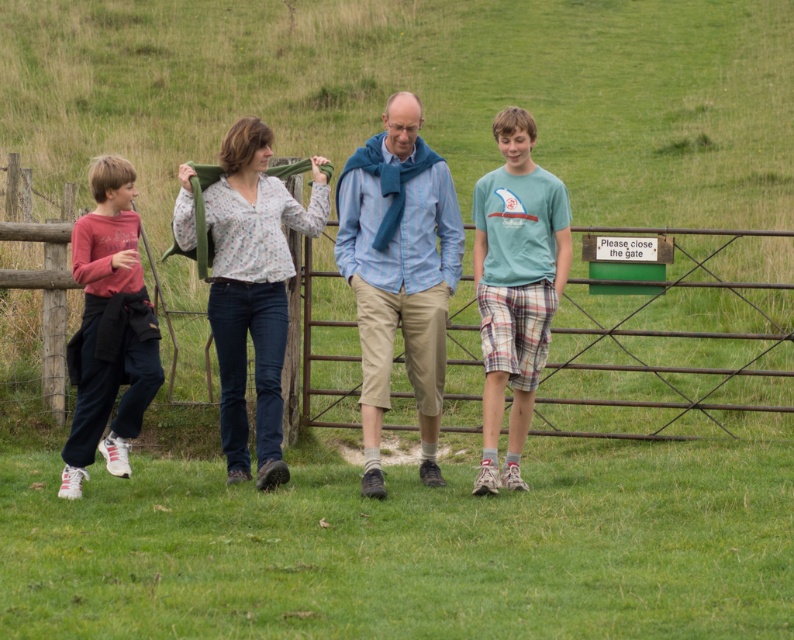
Between green wooden gate at center and floral print shirt at center, which one has less height?

green wooden gate at center

Between point (719, 252) and point (233, 454), which one is positioned in front?

Positioned in front is point (233, 454).

This screenshot has width=794, height=640. What are the coordinates of `green wooden gate at center` in the screenshot? It's located at (673, 346).

Can you confirm if green wooden gate at center is wider than light blue striped shirt at center?

Indeed, green wooden gate at center has a greater width compared to light blue striped shirt at center.

Can you confirm if green wooden gate at center is taller than light blue striped shirt at center?

No.

Is point (744, 360) positioned before point (361, 417)?

No, (744, 360) is behind (361, 417).

Where is `green wooden gate at center`? green wooden gate at center is located at coordinates (673, 346).

Between point (272, 472) and point (75, 422), which one is positioned in front?

Point (272, 472)

Does point (237, 291) come in front of point (87, 355)?

That is False.

Locate an element on the screen. The height and width of the screenshot is (640, 794). floral print shirt at center is located at coordinates (253, 289).